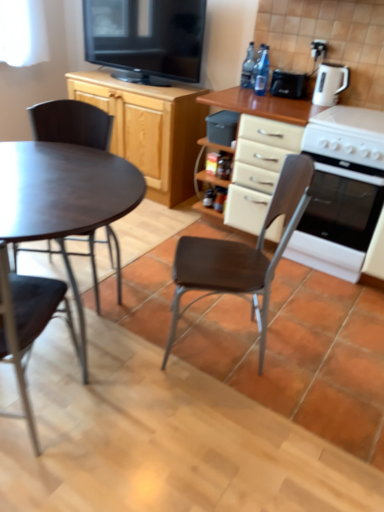
Find the location of `vacant space in front of brown leather chair at center, the third chair viewed from the left`. vacant space in front of brown leather chair at center, the third chair viewed from the left is located at coordinates pos(222,414).